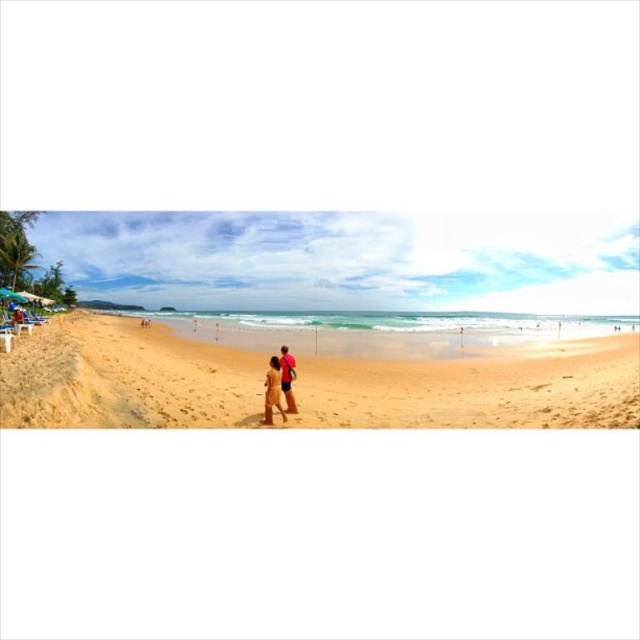
Can you confirm if golden sand beach at center is smaller than matte red shirt at center?

No.

Which of these two, golden sand beach at center or matte red shirt at center, stands taller?

With more height is golden sand beach at center.

You are a GUI agent. You are given a task and a screenshot of the screen. Output one action in this format:
    pyautogui.click(x=<x>, y=<y>)
    Task: Click on the golden sand beach at center
    This screenshot has height=640, width=640.
    Given the screenshot: What is the action you would take?
    pyautogui.click(x=476, y=388)

Based on the photo, which is more to the right, tan skin couple at center or matte red shirt at center?

matte red shirt at center is more to the right.

The width and height of the screenshot is (640, 640). What do you see at coordinates (278, 385) in the screenshot? I see `tan skin couple at center` at bounding box center [278, 385].

Where is `tan skin couple at center`? tan skin couple at center is located at coordinates (278, 385).

Is golden sand beach at center bigger than tan skin couple at center?

Yes, golden sand beach at center is bigger than tan skin couple at center.

Which is above, golden sand beach at center or tan skin couple at center?

Positioned higher is golden sand beach at center.

Where is `golden sand beach at center`? golden sand beach at center is located at coordinates [x=476, y=388].